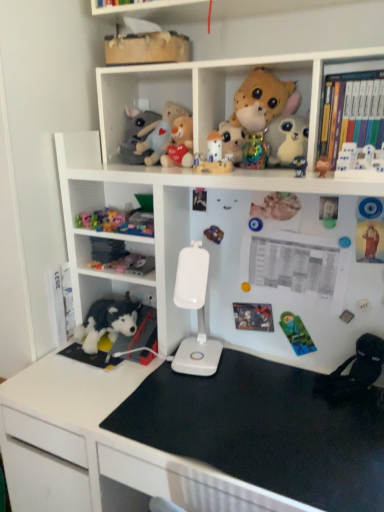
Image resolution: width=384 pixels, height=512 pixels. Find the location of `black fabric swivel chair at lower right`. black fabric swivel chair at lower right is located at coordinates (353, 372).

Find the location of a particular element. matte gray plush at upper center, which ranks as the third toy in top-to-bottom order is located at coordinates (136, 135).

How much space does white plastic toy at upper center, which is the 6th toy in top-to-bottom order, occupy horizontally?

white plastic toy at upper center, which is the 6th toy in top-to-bottom order, is 2.44 inches in width.

Describe the element at coordinates (323, 165) in the screenshot. I see `brown plush bear at upper right, the eighth toy in the bottom-to-top sequence` at that location.

Image resolution: width=384 pixels, height=512 pixels. Identify the location of black fabric swivel chair at lower right. (353, 372).

Is soft plush toy at upper center, acting as the 2th toy starting from the top, touching blue plastic toy at upper right, placed as the sixth toy when sorted from bottom to top?

No, soft plush toy at upper center, acting as the 2th toy starting from the top, is not touching blue plastic toy at upper right, placed as the sixth toy when sorted from bottom to top.

In terms of height, does soft plush toy at upper center, acting as the 2th toy starting from the top, look taller or shorter compared to blue plastic toy at upper right, which appears as the 10th toy when viewed from the top?

soft plush toy at upper center, acting as the 2th toy starting from the top, is taller than blue plastic toy at upper right, which appears as the 10th toy when viewed from the top.

Considering the sizes of objects soft plush toy at upper center, the fourteenth toy ordered from the bottom, and blue plastic toy at upper right, placed as the sixth toy when sorted from bottom to top, in the image provided, who is bigger, soft plush toy at upper center, the fourteenth toy ordered from the bottom, or blue plastic toy at upper right, placed as the sixth toy when sorted from bottom to top,?

soft plush toy at upper center, the fourteenth toy ordered from the bottom.

Is soft plush toy at upper center, the fourteenth toy ordered from the bottom, positioned before blue plastic toy at upper right, placed as the sixth toy when sorted from bottom to top?

No.

Is white plastic bookcase at upper center not inside matte gray plush at upper center, the thirteenth toy positioned from the bottom?

Yes, white plastic bookcase at upper center is located beyond the bounds of matte gray plush at upper center, the thirteenth toy positioned from the bottom.

In the scene shown: In terms of width, does white plastic bookcase at upper center look wider or thinner when compared to matte gray plush at upper center, which ranks as the third toy in top-to-bottom order?

white plastic bookcase at upper center is wider than matte gray plush at upper center, which ranks as the third toy in top-to-bottom order.

Is white plastic bookcase at upper center to the left or to the right of matte gray plush at upper center, which ranks as the third toy in top-to-bottom order, in the image?

white plastic bookcase at upper center is positioned on matte gray plush at upper center, which ranks as the third toy in top-to-bottom order,'s right side.

Considering the sizes of objects white plastic bookcase at upper center and matte gray plush at upper center, which ranks as the third toy in top-to-bottom order, in the image provided, who is smaller, white plastic bookcase at upper center or matte gray plush at upper center, which ranks as the third toy in top-to-bottom order,?

matte gray plush at upper center, which ranks as the third toy in top-to-bottom order, is smaller.

Locate an element on the screen. the 2nd toy behind when counting from the black fabric swivel chair at lower right is located at coordinates (260, 100).

Does black fabric swivel chair at lower right have a lesser height compared to soft plush toy at upper center, the fourteenth toy ordered from the bottom?

Yes.

Is black fabric swivel chair at lower right at the left side of soft plush toy at upper center, the fourteenth toy ordered from the bottom?

No, black fabric swivel chair at lower right is not to the left of soft plush toy at upper center, the fourteenth toy ordered from the bottom.

Is black fabric swivel chair at lower right inside or outside of soft plush toy at upper center, acting as the 2th toy starting from the top?

black fabric swivel chair at lower right is not enclosed by soft plush toy at upper center, acting as the 2th toy starting from the top.

The width and height of the screenshot is (384, 512). In order to click on book below the fluffy plush toys at upper center (from the image's perspective) in this screenshot , I will do `click(352, 114)`.

Is hardcover books at upper right inside the boundaries of fluffy plush toys at upper center, or outside?

hardcover books at upper right is not enclosed by fluffy plush toys at upper center.

Is the depth of hardcover books at upper right greater than that of fluffy plush toys at upper center?

No, hardcover books at upper right is in front of fluffy plush toys at upper center.

Is point (179, 149) farther from viewer compared to point (227, 128)?

That is False.

Considering the positions of objects fluffy plush toy at center, placed as the 4th toy when sorted from top to bottom, and matte plastic toy at upper center, acting as the 5th toy starting from the top, in the image provided, who is behind, fluffy plush toy at center, placed as the 4th toy when sorted from top to bottom, or matte plastic toy at upper center, acting as the 5th toy starting from the top,?

matte plastic toy at upper center, acting as the 5th toy starting from the top, is more distant.

Identify the location of the 1st toy above the matte plastic toy at upper center, which is the 11th toy from bottom to top (from the image's perspective). (180, 144).

From a real-world perspective, is fluffy plush toy at center, the 12th toy in the bottom-to-top sequence, located higher than matte plastic toy at upper center, which is the 11th toy from bottom to top?

Yes, from a real-world perspective, fluffy plush toy at center, the 12th toy in the bottom-to-top sequence, is over matte plastic toy at upper center, which is the 11th toy from bottom to top

How many degrees apart are the facing directions of white glossy picture frame at upper center, which is the 5th toy in bottom-to-top order, and white plastic lamp at center?

12.7 degrees.

Does white glossy picture frame at upper center, which is the 5th toy in bottom-to-top order, appear on the right side of white plastic lamp at center?

Indeed, white glossy picture frame at upper center, which is the 5th toy in bottom-to-top order, is positioned on the right side of white plastic lamp at center.

Is white plastic lamp at center a part of white glossy picture frame at upper center, which is the 5th toy in bottom-to-top order?

No, white plastic lamp at center is not a part of white glossy picture frame at upper center, which is the 5th toy in bottom-to-top order.

Between white glossy picture frame at upper center, placed as the eleventh toy when sorted from top to bottom, and white plastic lamp at center, which one has smaller size?

white glossy picture frame at upper center, placed as the eleventh toy when sorted from top to bottom.

Considering the positions of points (307, 351) and (162, 57), is point (307, 351) closer to camera compared to point (162, 57)?

No.

From a real-world perspective, which object stands above the other?

In real-world perspective, wooden toy at upper center, arranged as the first toy when viewed from the top, is above.

Between green fabric sleeping bag at lower right, the fifteenth toy positioned from the top, and wooden toy at upper center, arranged as the first toy when viewed from the top, which one appears on the left side from the viewer's perspective?

wooden toy at upper center, arranged as the first toy when viewed from the top.

The height and width of the screenshot is (512, 384). I want to click on the 3rd toy in front of the wooden toy at upper center, arranged as the first toy when viewed from the top, counting from the anchor's position, so click(296, 333).

The width and height of the screenshot is (384, 512). Find the location of `the 5th toy counting from the right side of the soft plush toy at upper center, the fourteenth toy ordered from the bottom`. the 5th toy counting from the right side of the soft plush toy at upper center, the fourteenth toy ordered from the bottom is located at coordinates (370, 208).

I want to click on the 15th toy behind when counting from the white plastic bookcase at upper center, so click(x=136, y=135).

When comparing their distances from white plastic bookcase at upper center, does white plastic lamp at center or blue plastic toy at upper right, placed as the sixth toy when sorted from bottom to top, seem further?

blue plastic toy at upper right, placed as the sixth toy when sorted from bottom to top, lies further to white plastic bookcase at upper center than the other object.

When comparing their distances from green fabric sleeping bag at lower right, the fifteenth toy positioned from the top, does fluffy plush toy at center, placed as the 4th toy when sorted from top to bottom, or white plastic toy at upper center, which is the 6th toy in top-to-bottom order, seem further?

The object further to green fabric sleeping bag at lower right, the fifteenth toy positioned from the top, is fluffy plush toy at center, placed as the 4th toy when sorted from top to bottom.

Estimate the real-world distances between objects in this image. Which object is further from blue plastic toy at upper right, which appears as the 10th toy when viewed from the top, black plush toy at lower left, marked as the 2th toy in a bottom-to-top arrangement, or metallic shiny toy at center, marked as the third toy in a bottom-to-top arrangement?

black plush toy at lower left, marked as the 2th toy in a bottom-to-top arrangement.

Considering their positions, is white plastic bookcase at upper center positioned closer to matte plastic toy at upper center, acting as the 5th toy starting from the top, than green fabric sleeping bag at lower right, which appears as the 1th toy when ordered from the bottom?

white plastic bookcase at upper center.

Estimate the real-world distances between objects in this image. Which object is closer to blue plastic toy at upper right, placed as the sixth toy when sorted from bottom to top, fluffy plush toys at upper center or white glossy picture frame at upper center, which is the 5th toy in bottom-to-top order?

The object closer to blue plastic toy at upper right, placed as the sixth toy when sorted from bottom to top, is white glossy picture frame at upper center, which is the 5th toy in bottom-to-top order.

When comparing their distances from white plastic lamp at center, does fluffy plush toys at upper center or fluffy plush toy at center, placed as the 4th toy when sorted from top to bottom, seem further?

Among the two, fluffy plush toys at upper center is located further to white plastic lamp at center.

Looking at the image, which one is located further to metallic shiny toy at center, the 13th toy in the top-to-bottom sequence, white plastic bookcase at upper center or white plastic toy at upper center, which is the 6th toy in top-to-bottom order?

The object further to metallic shiny toy at center, the 13th toy in the top-to-bottom sequence, is white plastic bookcase at upper center.

Looking at this image, from the image, which object appears to be farther from plush toy at lower left, acting as the fourth toy starting from the bottom, white plastic bookcase at upper center or matte plastic toy at upper center, positioned as the 7th toy in top-to-bottom order?

Among the two, matte plastic toy at upper center, positioned as the 7th toy in top-to-bottom order, is located further to plush toy at lower left, acting as the fourth toy starting from the bottom.

This screenshot has width=384, height=512. Identify the location of book between soft plush toy at upper center, acting as the 2th toy starting from the top, and white glossy picture frame at upper center, which is the 5th toy in bottom-to-top order, from top to bottom. (352, 114).

This screenshot has width=384, height=512. I want to click on shelf between soft plush toy at upper center, acting as the 2th toy starting from the top, and white plastic bookcase at upper center, in the vertical direction, so click(137, 94).

Where is `swivel chair located between black matte desk at center and metallic shiny toy at center, marked as the third toy in a bottom-to-top arrangement, in the depth direction`? swivel chair located between black matte desk at center and metallic shiny toy at center, marked as the third toy in a bottom-to-top arrangement, in the depth direction is located at coordinates (353, 372).

This screenshot has height=512, width=384. In order to click on bookcase between brown plush bear at upper right, the eighth toy in the bottom-to-top sequence, and black matte desk at center, in the vertical direction in this screenshot , I will do `click(227, 218)`.